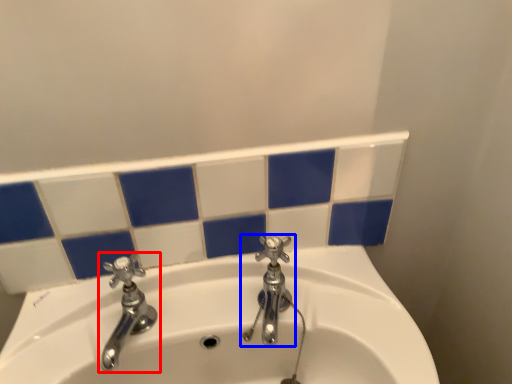
Question: Among these objects, which one is nearest to the camera, tap (highlighted by a red box) or tap (highlighted by a blue box)?

Choices:
 (A) tap
 (B) tap

Answer: (A)